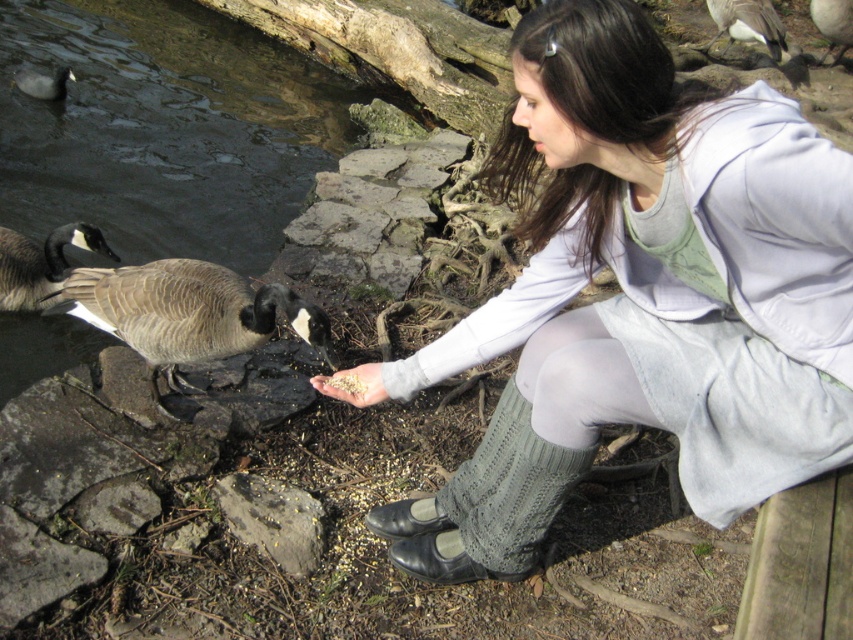
You are standing at the wooden bench on the right side of the frame and want to walk to the person feeding the geese. Which point, point (589, 200) or point (62, 310), is closer to your starting position?

Point (589, 200) is closer to the viewer than point (62, 310), so the closer point to your starting position at the wooden bench is point (589, 200).

You are a photographer trying to capture the exact position of the gray rough rock at lower center in the image. According to the coordinates provided, what are the x and y values of its location?

The gray rough rock at lower center is located at the 2D coordinates of x 0.812 and y 0.321.